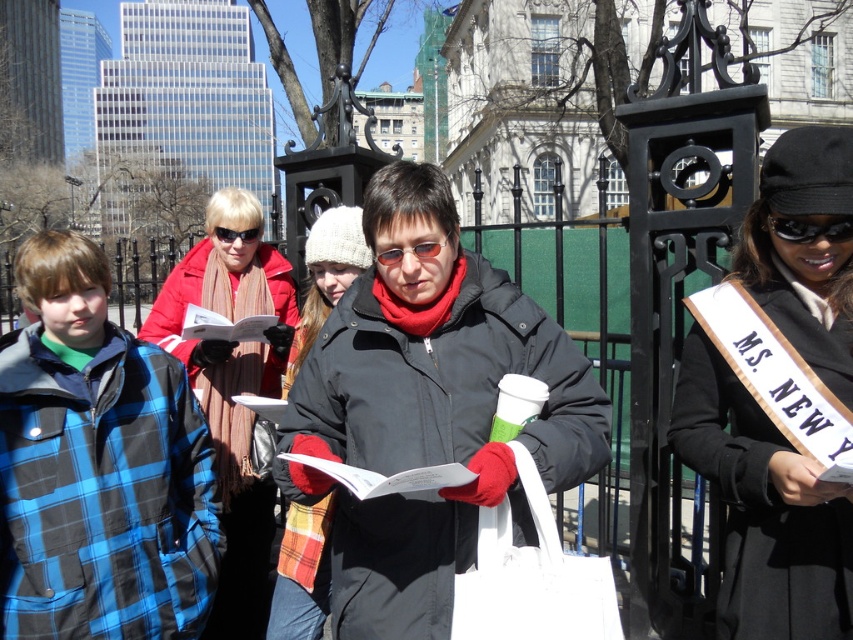
You are a photographer trying to capture a photo of the sunglasses at center without including the black plastic goggles at upper right. Based on their positions, is this possible?

The black plastic goggles at upper right is above the sunglasses at center, so if you position the camera to focus on the sunglasses at center and avoid the upper right area, you can exclude the goggles from the frame.

You are a photographer trying to capture a clear shot of both the black fabric sash at center and the black plastic goggles at upper right. Based on their positions, which object should you focus on first to ensure both are in frame?

The black fabric sash at center is above the black plastic goggles at upper right, so you should focus on the black plastic goggles at upper right first to ensure both are in frame.